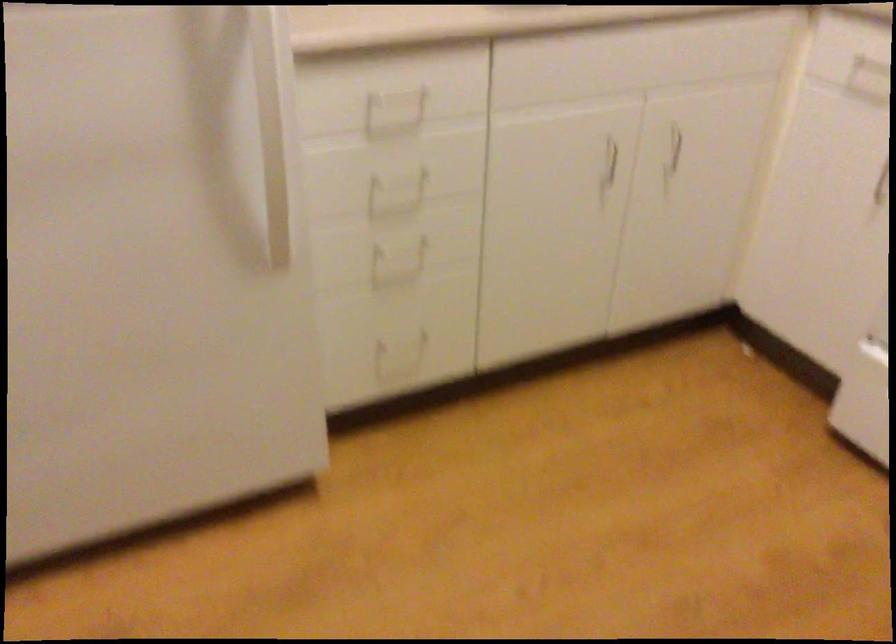
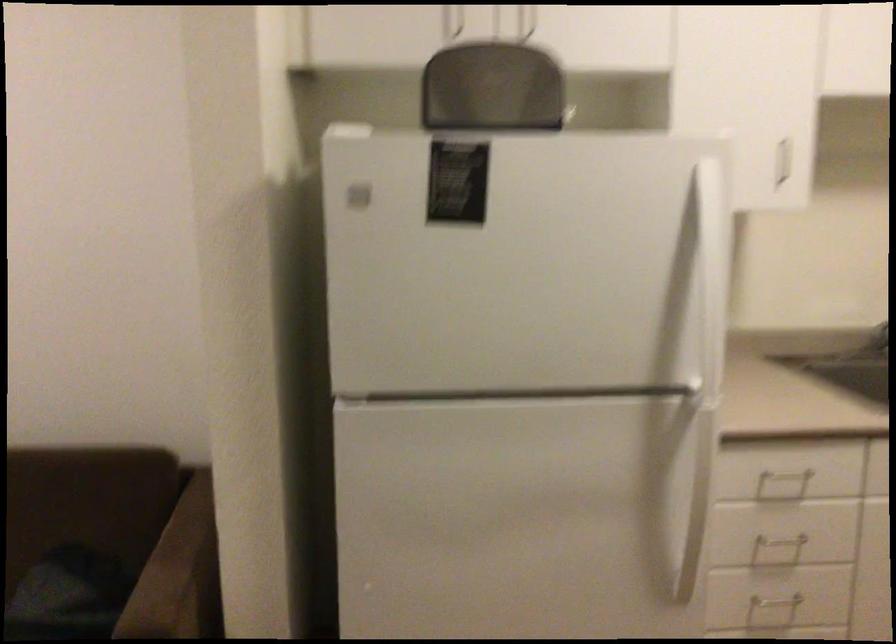
Based on the photo, based on the continuous images, in which direction is the camera rotating?

The rotation direction of the camera is left-up.